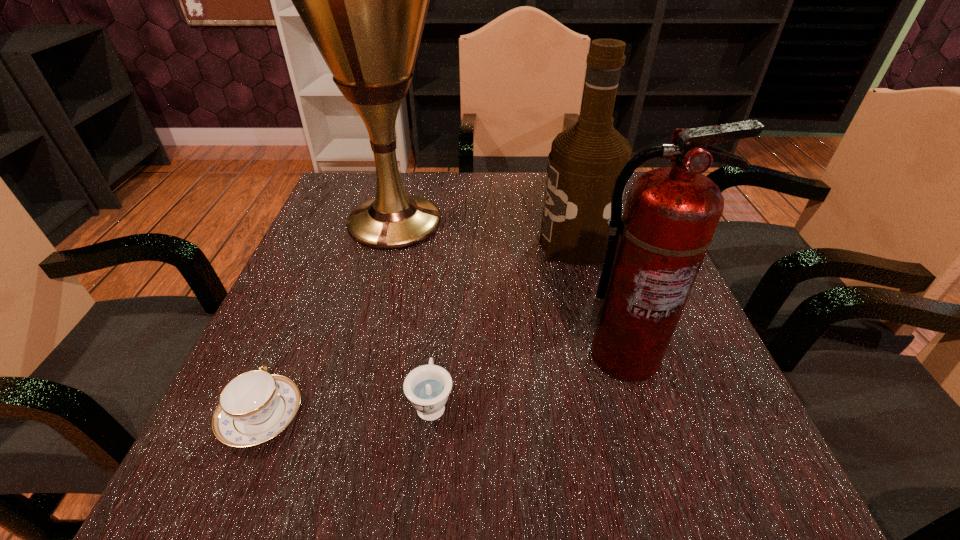
Where is `alcohol at the right edge`? This screenshot has width=960, height=540. alcohol at the right edge is located at coordinates (585, 160).

The image size is (960, 540). What are the coordinates of `fire extinguisher positioned at the right edge` in the screenshot? It's located at (654, 252).

Locate an element on the screen. Image resolution: width=960 pixels, height=540 pixels. object that is at the far left corner is located at coordinates (364, 0).

Image resolution: width=960 pixels, height=540 pixels. What are the coordinates of `object present at the near left corner` in the screenshot? It's located at (255, 406).

Find the location of `free space at the far edge of the desktop`. free space at the far edge of the desktop is located at coordinates (466, 218).

This screenshot has width=960, height=540. Identify the location of vacant space at the near edge of the desktop. pos(533,502).

Locate an element on the screen. free space at the left edge of the desktop is located at coordinates (354, 336).

In the image, there is a desktop. Where is `free space at the right edge`? free space at the right edge is located at coordinates coord(726,443).

In the image, there is a desktop. Find the location of `vacant region at the far left corner`. vacant region at the far left corner is located at coordinates (368, 176).

Where is `vacant area at the near left corner of the desktop`? vacant area at the near left corner of the desktop is located at coordinates (191, 495).